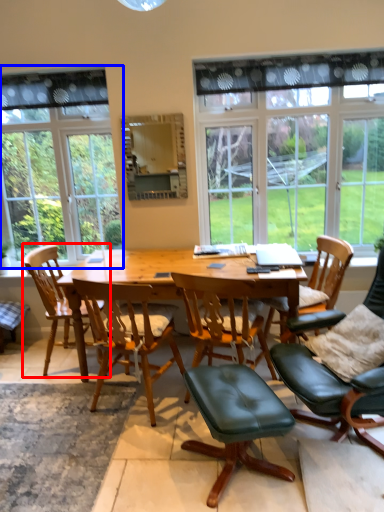
Question: Which point is further to the camera, chair (highlighted by a red box) or window (highlighted by a blue box)?

Choices:
 (A) chair
 (B) window

Answer: (B)